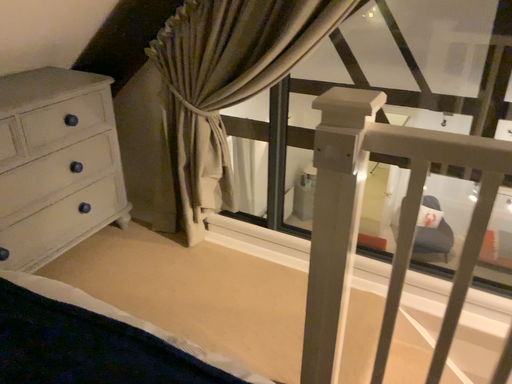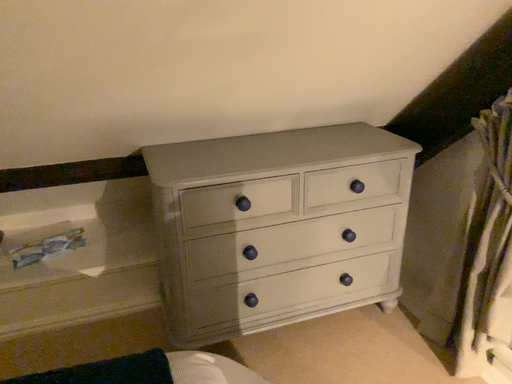
Question: Which way did the camera rotate in the video?

Choices:
 (A) rotated right
 (B) rotated left

Answer: (B)